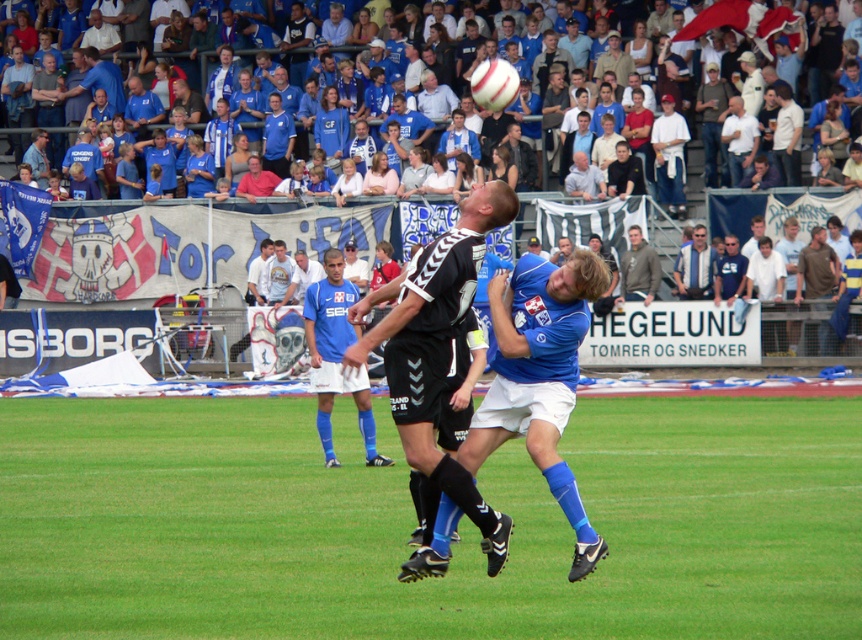
Question: Does green grass at center have a lesser width compared to blue fabric at upper center?

Choices:
 (A) no
 (B) yes

Answer: (B)

Question: Which point appears farthest from the camera in this image?

Choices:
 (A) (714, 266)
 (B) (742, 3)
 (C) (650, 250)
 (D) (641, 490)

Answer: (B)

Question: Can you confirm if green grass at center is positioned above gray hoodie at center?

Choices:
 (A) yes
 (B) no

Answer: (B)

Question: Which object is the farthest from the striped shirt at center?

Choices:
 (A) green grass at center
 (B) gray hoodie at center

Answer: (A)

Question: Considering the real-world distances, which object is closest to the blue fabric at upper center?

Choices:
 (A) green grass at center
 (B) striped shirt at center

Answer: (B)

Question: Does striped shirt at center have a lesser width compared to gray hoodie at center?

Choices:
 (A) no
 (B) yes

Answer: (A)